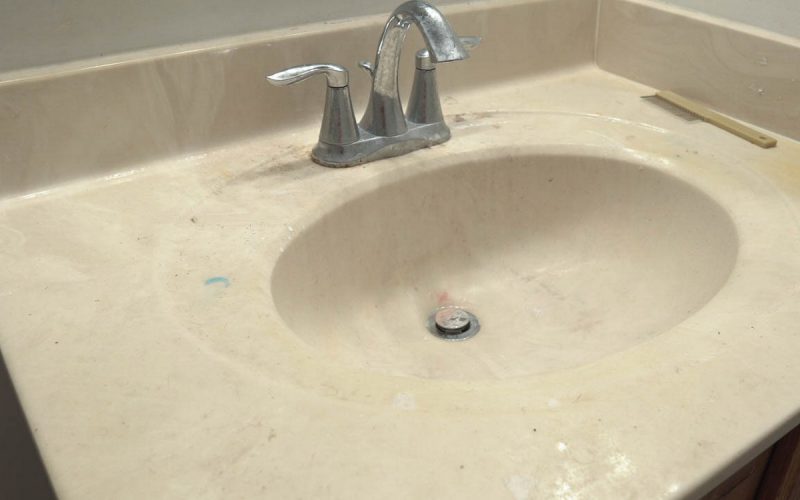
Locate an element on the screen. back of sink basing is located at coordinates (437, 242).